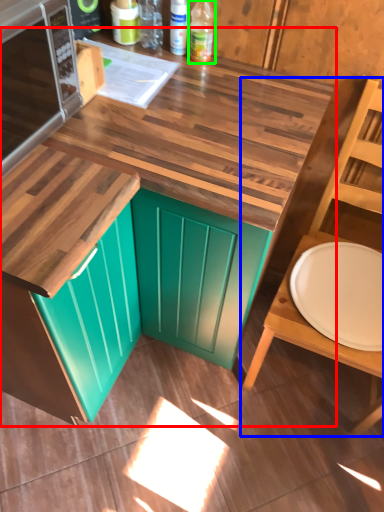
Question: Which object is positioned farthest from countertop (highlighted by a red box)? Select from chair (highlighted by a blue box) and bottle (highlighted by a green box).

Choices:
 (A) chair
 (B) bottle

Answer: (B)